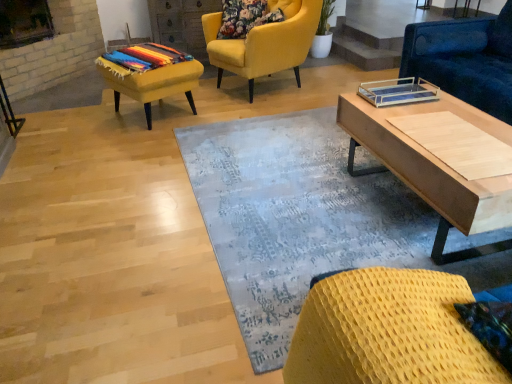
Question: Considering the positions of point (410, 31) and point (463, 331), is point (410, 31) closer or farther from the camera than point (463, 331)?

Choices:
 (A) closer
 (B) farther

Answer: (B)

Question: Considering the positions of blue fabric couch at upper right, the 2th chair viewed from the front, and woven yellow chair at lower right, marked as the second chair in a right-to-left arrangement, in the image, is blue fabric couch at upper right, the 2th chair viewed from the front, taller or shorter than woven yellow chair at lower right, marked as the second chair in a right-to-left arrangement,?

Choices:
 (A) short
 (B) tall

Answer: (B)

Question: Which object is the closest to the multicolored woven blanket at left?

Choices:
 (A) blue fabric couch at upper right, which ranks as the 3th chair in left-to-right order
 (B) light wood coffee table at right
 (C) woven yellow chair at lower right, which ranks as the second chair in left-to-right order
 (D) blue textured rug at center
 (E) multicolored woven stool at left

Answer: (E)

Question: Considering the real-world distances, which object is farthest from the woven yellow chair at lower right, marked as the second chair in a right-to-left arrangement?

Choices:
 (A) blue fabric couch at upper right, which ranks as the 3th chair in left-to-right order
 (B) light wood coffee table at right
 (C) multicolored woven blanket at left
 (D) multicolored woven stool at left
 (E) blue textured rug at center

Answer: (C)